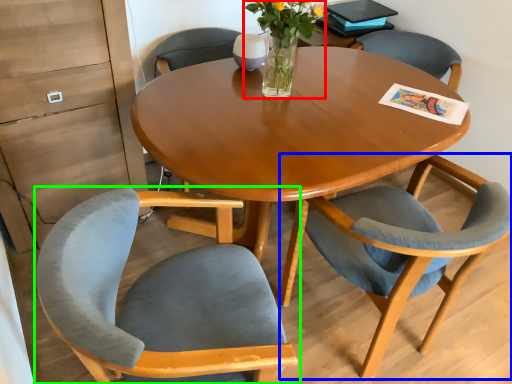
Question: Based on their relative distances, which object is farther from floral arrangement (highlighted by a red box)? Choose from chair (highlighted by a blue box) and chair (highlighted by a green box).

Choices:
 (A) chair
 (B) chair

Answer: (B)